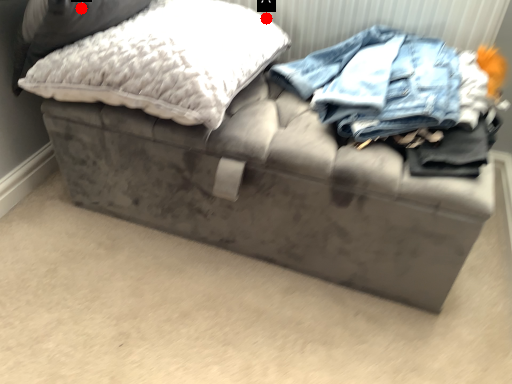
Question: Two points are circled on the image, labeled by A and B beside each circle. Which point is farther to the camera?

Choices:
 (A) A is further
 (B) B is further

Answer: (A)